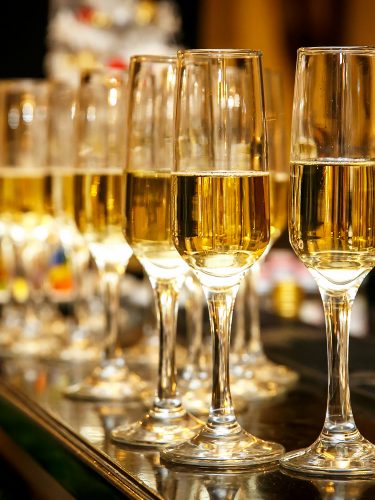
At what (x,y) coordinates should I click in order to perform the action: click on stem of glass. Please return your answer as a coordinate pair (x, y). Looking at the image, I should click on (333, 365), (222, 359), (168, 345), (253, 322), (242, 315), (199, 320), (111, 317), (80, 283), (36, 279), (10, 270).